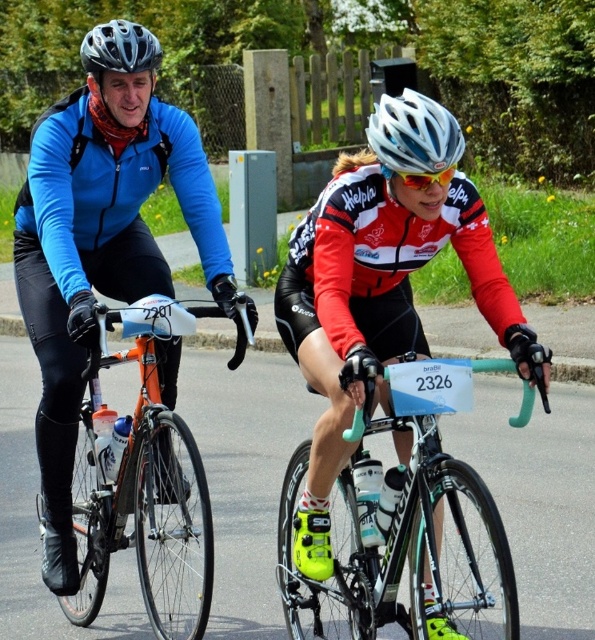
You are a photographer trying to capture a clear shot of the orange matte bicycle at left and the matte black helmet at upper left. Which object should you focus on first to ensure both are in frame without moving the camera?

The orange matte bicycle at left is positioned under the matte black helmet at upper left, so you should focus on the matte black helmet at upper left first to ensure both are in frame without moving the camera.